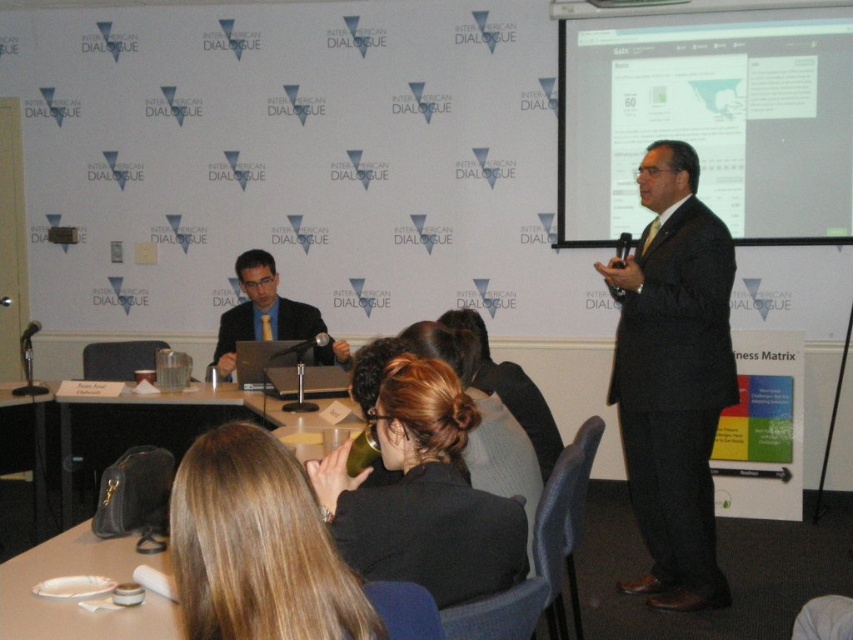
You are a photographer adjusting your camera settings to capture the presentation. You notice two points marked in the scene. Which point, point 1 at coordinates [242,522] or point 2 at [222,346], is closer to your camera lens?

Point 1 at coordinates [242,522] is closer to the camera lens than point 2 at [222,346].

You are an attendee at this presentation. You need to take a photo of the projector screen and the table for your notes. Which object, the matte white projector screen at upper right or the black leather table at lower left, will appear larger in your photo?

The matte white projector screen at upper right will appear larger in your photo because it is much taller than the black leather table at lower left.